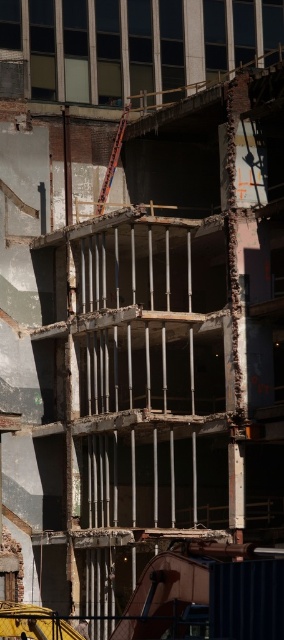
Who is taller, metallic helmet at center or yellow hard hat at center?

metallic helmet at center

Between point (80, 627) and point (26, 637), which one is positioned in front?

Point (26, 637) is in front.

Where is `metallic helmet at center`? The image size is (284, 640). metallic helmet at center is located at coordinates (82, 627).

Who is taller, rusty metal scaffolding at center or yellow hard hat at center?

Standing taller between the two is rusty metal scaffolding at center.

Does rusty metal scaffolding at center have a smaller size compared to yellow hard hat at center?

No, rusty metal scaffolding at center is not smaller than yellow hard hat at center.

Identify the location of rusty metal scaffolding at center. This screenshot has height=640, width=284. (147, 372).

Find the location of a particular element. The height and width of the screenshot is (640, 284). rusty metal scaffolding at center is located at coordinates (147, 372).

Who is shorter, rusty metal scaffolding at center or metallic helmet at center?

Standing shorter between the two is metallic helmet at center.

Describe the element at coordinates (147, 372) in the screenshot. The height and width of the screenshot is (640, 284). I see `rusty metal scaffolding at center` at that location.

Is point (188, 256) closer to viewer compared to point (84, 634)?

No, it is behind (84, 634).

At what (x,y) coordinates should I click in order to perform the action: click on rusty metal scaffolding at center. Please return your answer as a coordinate pair (x, y). Looking at the image, I should click on [x=147, y=372].